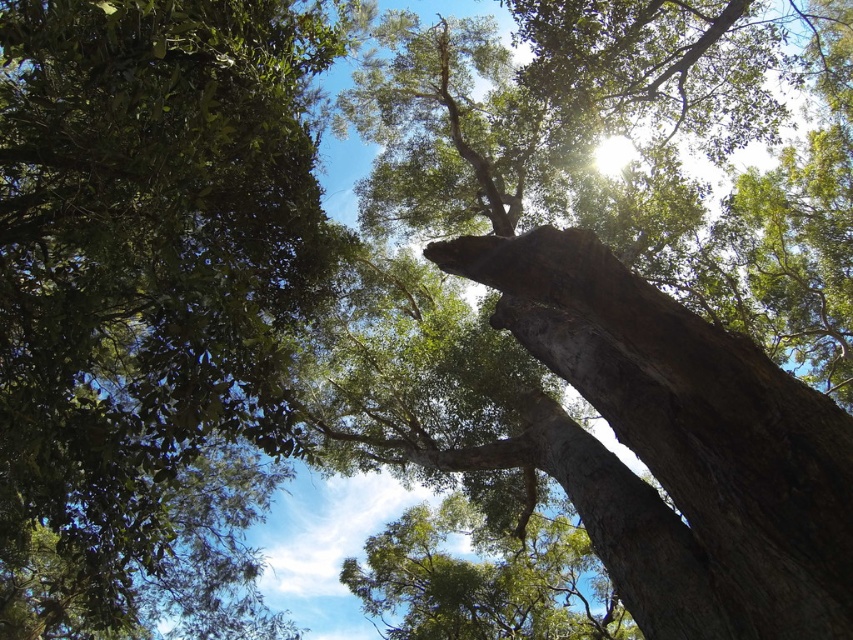
Measure the distance between green leafy tree at upper left and green rough bark tree at center.

The distance of green leafy tree at upper left from green rough bark tree at center is 61.29 feet.

What do you see at coordinates (144, 262) in the screenshot?
I see `green leafy tree at upper left` at bounding box center [144, 262].

Is point (171, 211) positioned in front of point (509, 593)?

Yes, it is.

I want to click on green leafy tree at upper left, so click(x=144, y=262).